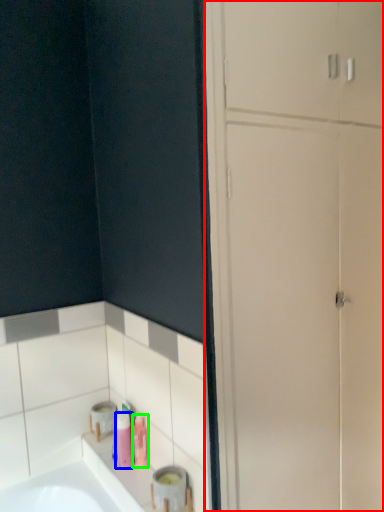
Question: Which object is positioned closest to dresser (highlighted by a red box)? Select from toiletry (highlighted by a blue box) and toiletry (highlighted by a green box).

Choices:
 (A) toiletry
 (B) toiletry

Answer: (B)